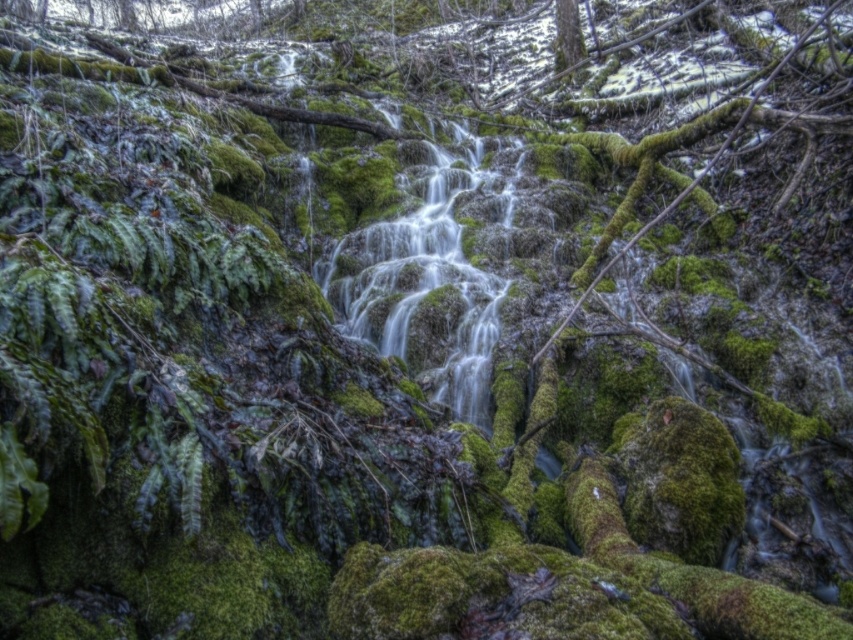
From the picture: Can you confirm if green mossy stream at center is wider than green mossy tree at upper center?

Incorrect, green mossy stream at center's width does not surpass green mossy tree at upper center's.

Identify the location of green mossy stream at center. The height and width of the screenshot is (640, 853). (426, 275).

Identify the location of green mossy stream at center. Image resolution: width=853 pixels, height=640 pixels. (426, 275).